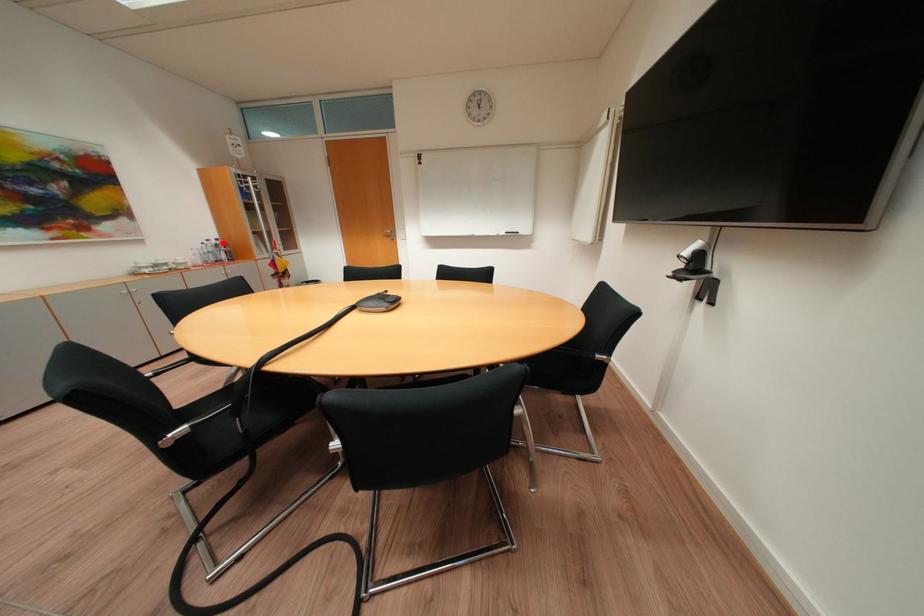
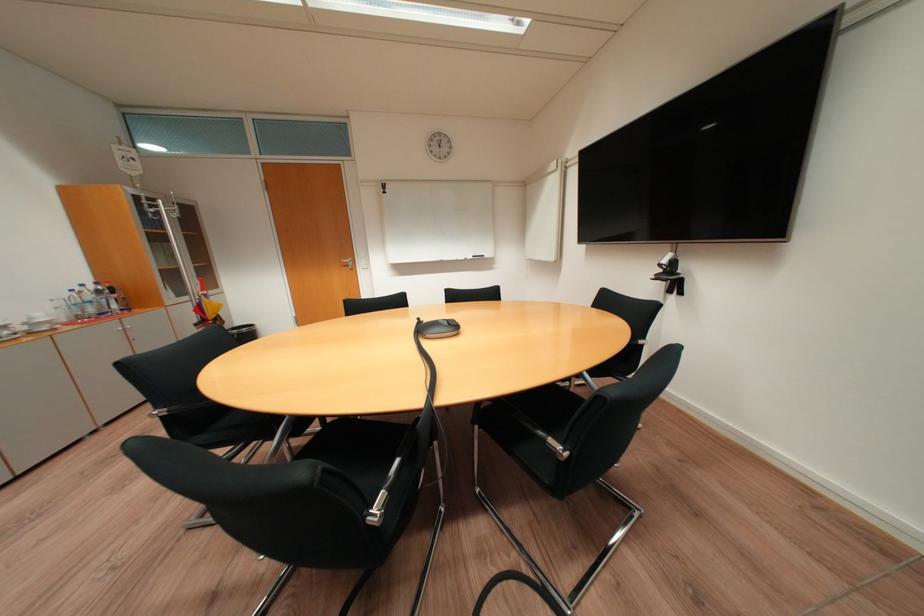
Question: I am providing you with two images of the same scene from different viewpoints. Given a red point in image1, look at the same physical point in image2. Is it:

Choices:
 (A) Closer to the viewpoint
 (B) Farther from the viewpoint

Answer: (B)